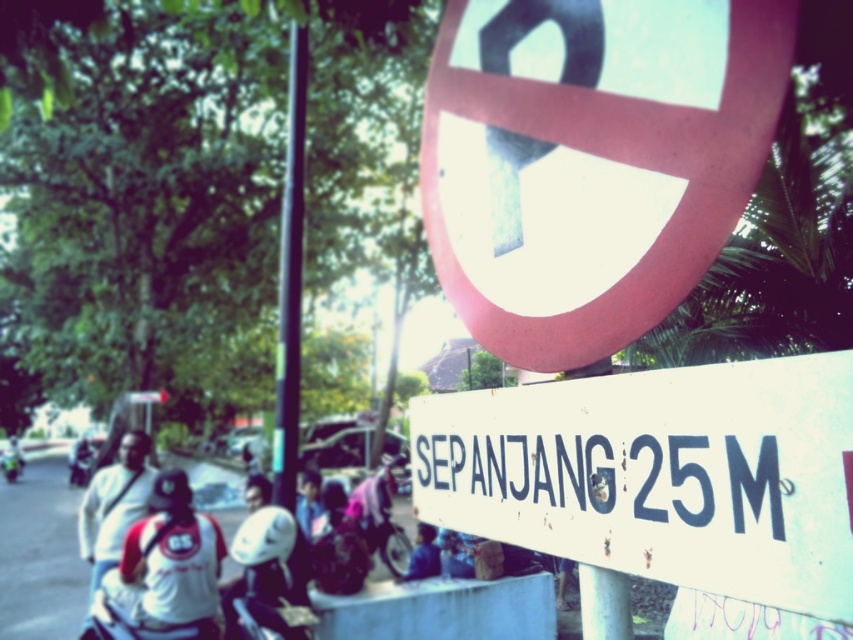
Does point (138, 452) lie behind point (6, 456)?

That is False.

Measure the distance between white matte shirt at left and camera.

white matte shirt at left is 6.37 meters from camera.

Image resolution: width=853 pixels, height=640 pixels. What are the coordinates of `white matte shirt at left` in the screenshot? It's located at (114, 504).

What do you see at coordinates (114, 504) in the screenshot?
I see `white matte shirt at left` at bounding box center [114, 504].

This screenshot has width=853, height=640. Describe the element at coordinates (114, 504) in the screenshot. I see `white matte shirt at left` at that location.

Locate an element on the screen. The height and width of the screenshot is (640, 853). white matte shirt at left is located at coordinates (114, 504).

Is white fabric shirt at lower left closer to camera compared to metallic pole at center?

Yes, it is in front of metallic pole at center.

Is white fabric shirt at lower left thinner than metallic pole at center?

No.

At what (x,y) coordinates should I click in order to perform the action: click on white fabric shirt at lower left. Please return your answer as a coordinate pair (x, y). Looking at the image, I should click on [x=169, y=561].